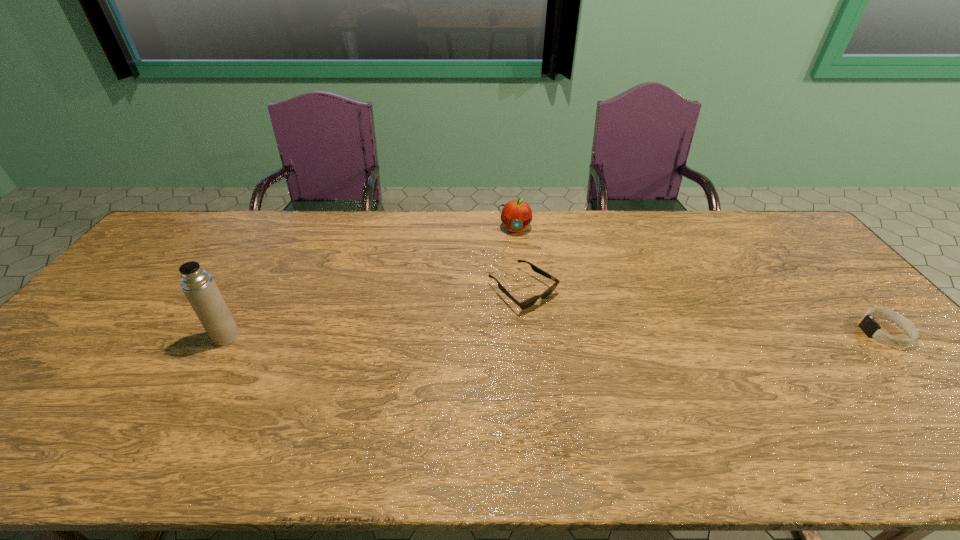
You are a GUI agent. You are given a task and a screenshot of the screen. Output one action in this format:
    pyautogui.click(x=<x>, y=<y>)
    Task: Click on the blank region between the wristband and the sunglasses
    
    Given the screenshot: What is the action you would take?
    pyautogui.click(x=704, y=311)

Select which object appears as the closest to the wristband. Please provide its 2D coordinates. Your answer should be formatted as a tuple, i.e. [(x, y)], where the tuple contains the x and y coordinates of a point satisfying the conditions above.

[(527, 303)]

The height and width of the screenshot is (540, 960). In order to click on the third closest object relative to the rightmost object in this screenshot , I will do `click(199, 287)`.

The image size is (960, 540). Find the location of `vacant region that satisfies the following two spatial constraints: 1. on the back side of the wristband; 2. on the outer surface of the tallest object`. vacant region that satisfies the following two spatial constraints: 1. on the back side of the wristband; 2. on the outer surface of the tallest object is located at coordinates (228, 332).

At what (x,y) coordinates should I click in order to perform the action: click on vacant region that satisfies the following two spatial constraints: 1. on the front side of the apple; 2. on the outer surface of the wristband. Please return your answer as a coordinate pair (x, y). Image resolution: width=960 pixels, height=540 pixels. Looking at the image, I should click on (525, 332).

At what (x,y) coordinates should I click in order to perform the action: click on free space that satisfies the following two spatial constraints: 1. on the back side of the thermos bottle; 2. on the outer surface of the wristband. Please return your answer as a coordinate pair (x, y). The width and height of the screenshot is (960, 540). Looking at the image, I should click on click(228, 332).